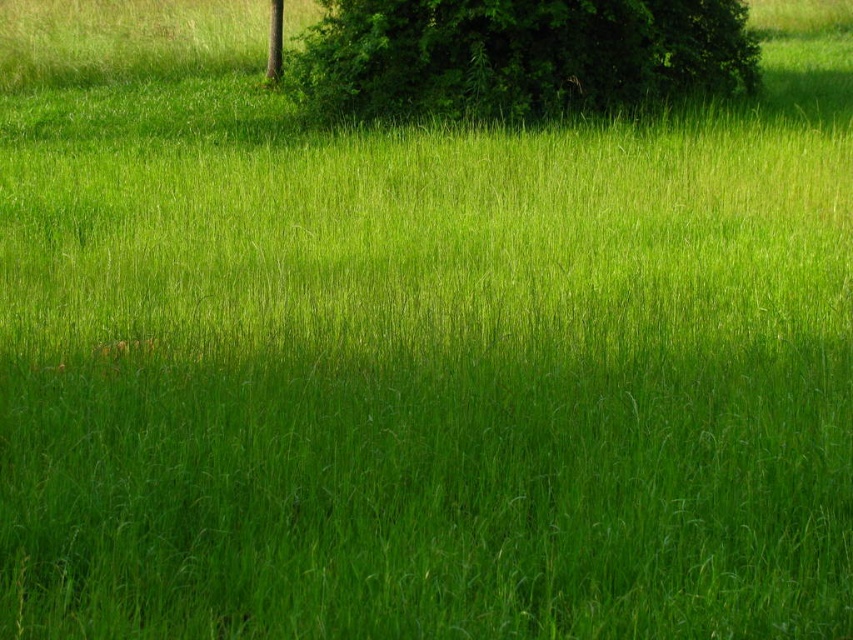
You are standing in the field and notice both the green leafy bush at upper center and the smooth brown tree trunk at upper center. Which one is closer to the ground?

The green leafy bush at upper center is shorter than the smooth brown tree trunk at upper center, so it is closer to the ground.

Based on the photo, A hiker is standing at point (454, 20) and wants to walk to the tree located at the edge of the field. The hiker has a map that shows the distance between their current position and the tree is 14.46 meters. Is this distance accurate according to the image?

Result: The distance between point (454, 20) and the tree located at the edge of the field is 14.46 meters, so the map is accurate.

You are standing in the field and see a point marked at coordinates (518, 56). What is located at that point?

At point (518, 56) lies a green leafy bush at upper center.